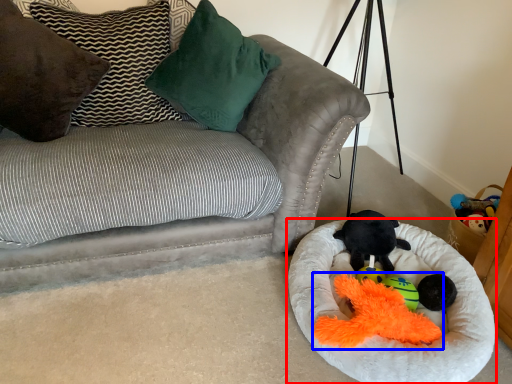
Question: Among these objects, which one is farthest to the camera, dog bed (highlighted by a red box) or miniature (highlighted by a blue box)?

Choices:
 (A) dog bed
 (B) miniature

Answer: (B)